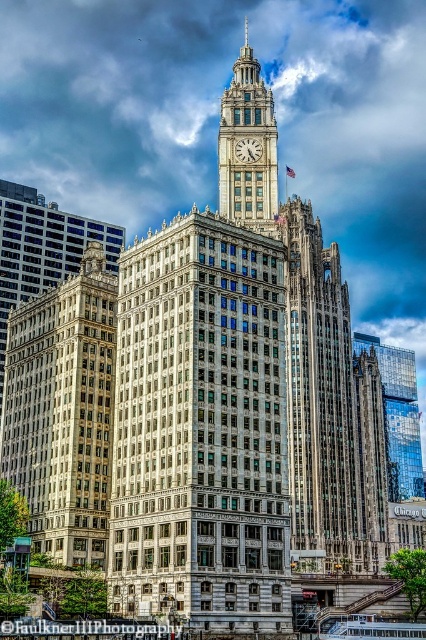
Question: Is white stone building at center further to the viewer compared to beige stone clock tower at center?

Choices:
 (A) no
 (B) yes

Answer: (A)

Question: Which of the following is the closest to the observer?

Choices:
 (A) beige stone clock tower at center
 (B) white stone building at center

Answer: (B)

Question: Which object appears farthest from the camera in this image?

Choices:
 (A) white marble clock at center
 (B) white stone building at center
 (C) gold/bronze stone building at left

Answer: (A)

Question: Does white stone building at center appear under gold/bronze stone building at left?

Choices:
 (A) yes
 (B) no

Answer: (A)

Question: Which of these objects is positioned farthest from the white marble clock at center?

Choices:
 (A) white stone building at center
 (B) beige stone clock tower at center
 (C) gold/bronze stone building at left

Answer: (A)

Question: Does white stone building at center appear on the right side of gold/bronze stone building at left?

Choices:
 (A) no
 (B) yes

Answer: (B)